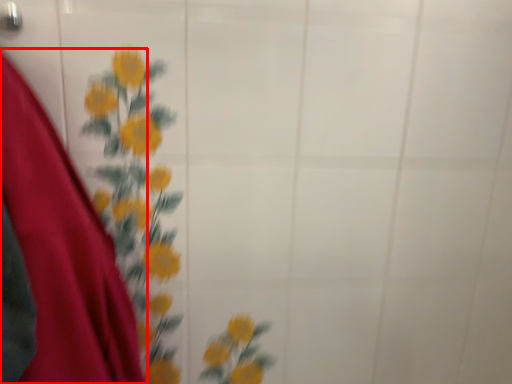
Question: Observing the image, what is the correct spatial positioning of dress (annotated by the red box) in reference to door handle?

Choices:
 (A) left
 (B) right

Answer: (B)